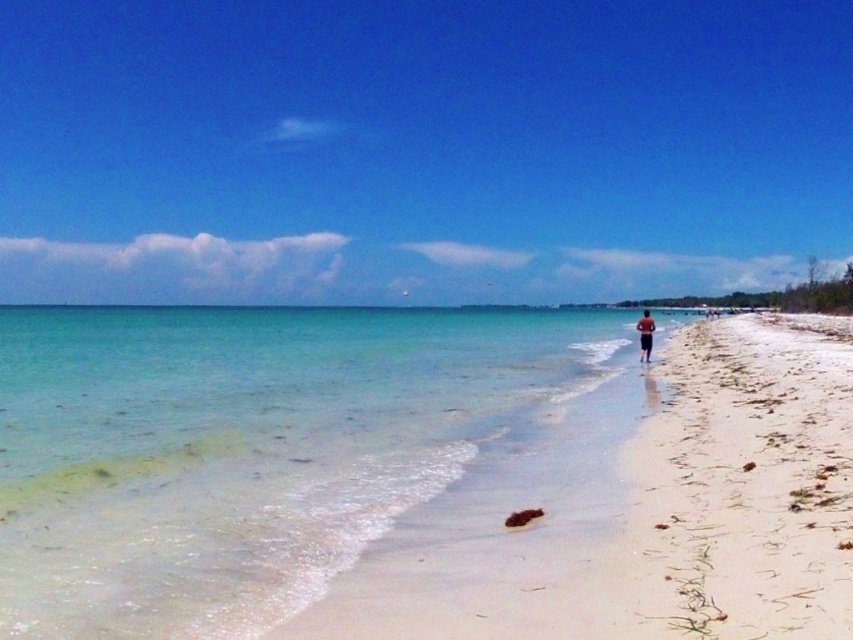
You are standing at the point marked by coordinates point (741,490) on the beach. What is the name of the location you are currently standing on?

The location you are standing on is the white sandy beach at right, as it is located at point (741,490).

You are planning to build a sandcastle on the beach. Which area would be more suitable between the white sandy beach at center and the white sandy beach at right? Explain your choice based on their sizes.

The white sandy beach at center is more suitable for building a sandcastle because it has a larger size compared to the white sandy beach at right, providing more space for construction.